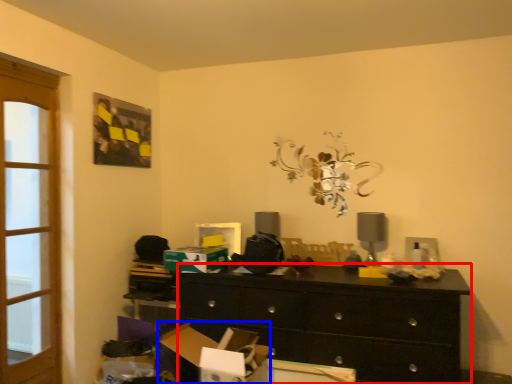
Question: Which point is further to the camera, chest of drawers (highlighted by a red box) or cardboard box (highlighted by a blue box)?

Choices:
 (A) chest of drawers
 (B) cardboard box

Answer: (A)